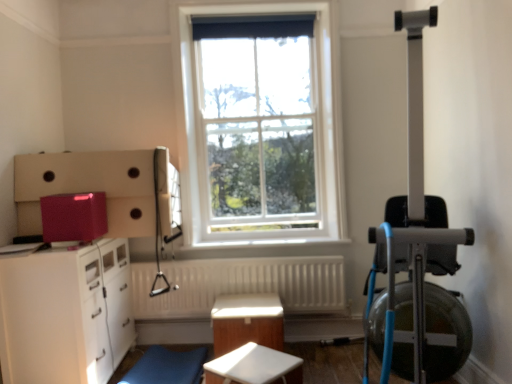
Locate an element on the screen. The image size is (512, 384). vacant space situated above white matte table at center, marked as the second table in a back-to-front arrangement (from a real-world perspective) is located at coordinates (245, 367).